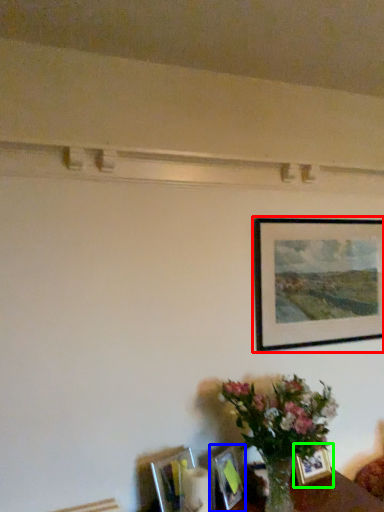
Question: Which object is positioned farthest from picture frame (highlighted by a red box)? Select from picture frame (highlighted by a blue box) and picture frame (highlighted by a green box).

Choices:
 (A) picture frame
 (B) picture frame

Answer: (A)